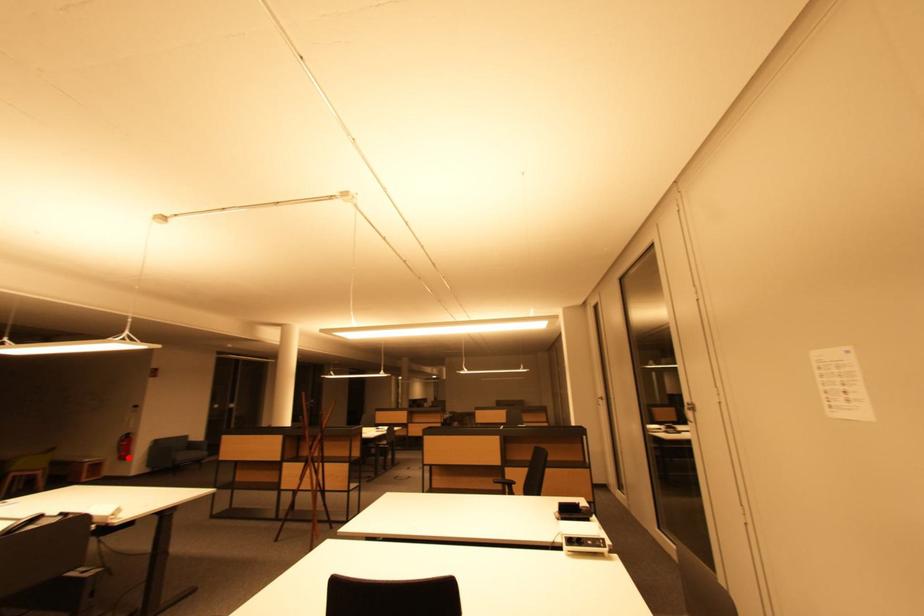
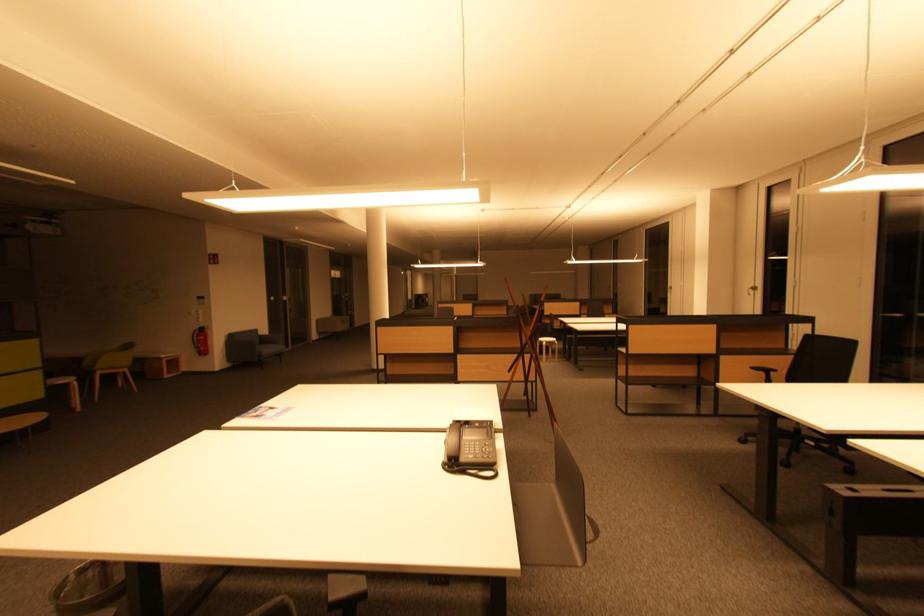
The point at the highlighted location is marked in the first image. Where is the corresponding point in the second image?

(207, 353)